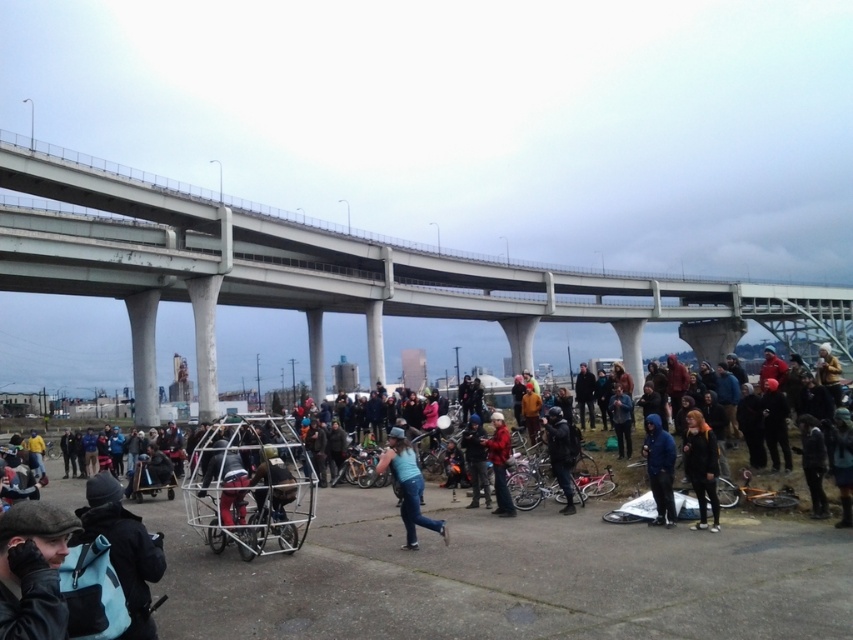
You are standing on the paved area near the bridge and want to find the blue denim jeans at center. According to the coordinates provided, where should you look?

You should look at point (407, 486) to find the blue denim jeans at center.

You are standing at the center of the paved area near the bridge and want to find the black fabric backpack at lower left. According to the coordinates provided, in which direction should you move relative to your current position?

The black fabric backpack at lower left is located at coordinates point (x=123, y=548). Since you are at the center, you should move towards the lower left direction to reach it.

You are standing at the point marked as point (30, 538) in the image. You want to walk to the nearest bridge entrance that is 30 meters away from your current position. Can you reach it without exceeding the 30 meter limit?

Yes, because the distance between you and the viewer is 25.67 meters, which is within the 30 meter limit.